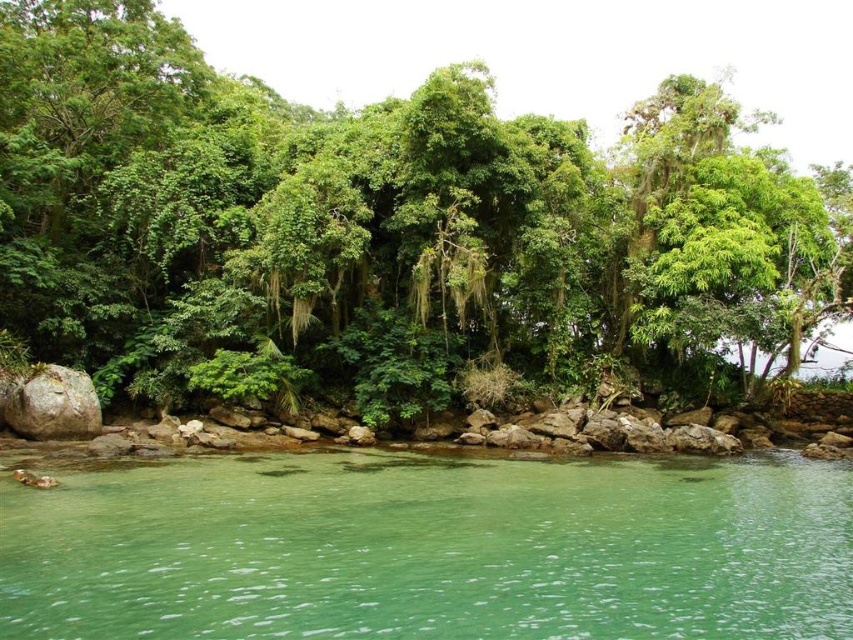
You are standing on a path near the green leafy tree at center and the green translucent water at lower center. If you look down, which object is directly below your feet?

The green translucent water at lower center is directly below your feet since it is positioned lower than the green leafy tree at center.